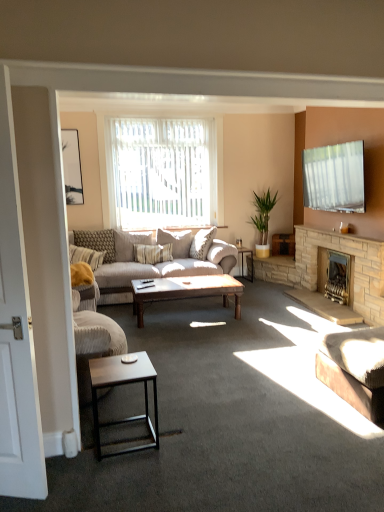
Find the location of a particular element. blank space situated above dark brown wooden coffee table at center, the first coffee table positioned from the front (from a real-world perspective) is located at coordinates (119, 366).